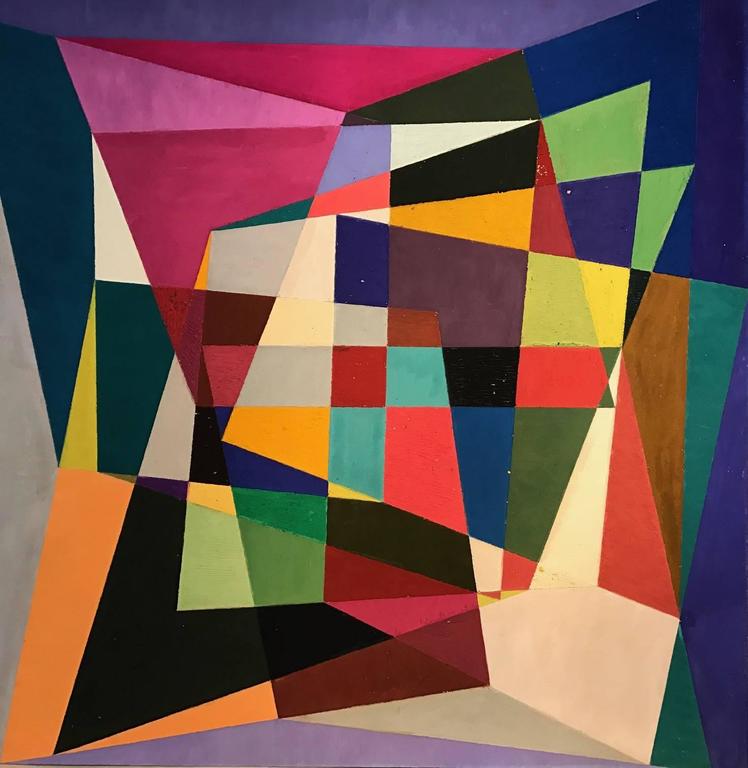
Identify the location of grey corner. The image size is (748, 768). (12, 613).